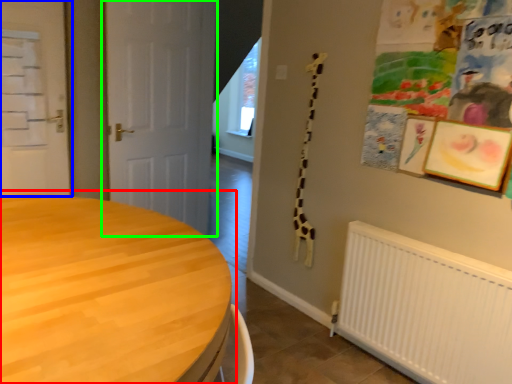
Question: Based on their relative distances, which object is nearer to table (highlighted by a red box)? Choose from door (highlighted by a blue box) and door (highlighted by a green box).

Choices:
 (A) door
 (B) door

Answer: (B)